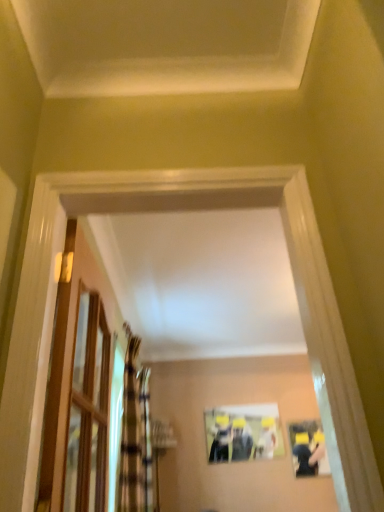
Question: Is the depth of gold textured curtain at left, which is the 1th curtain from front to back, greater than that of matte black couple at center?

Choices:
 (A) yes
 (B) no

Answer: (B)

Question: Is gold textured curtain at left, which is the 1th curtain from front to back, closer to the viewer compared to matte black couple at center?

Choices:
 (A) no
 (B) yes

Answer: (B)

Question: Does gold textured curtain at left, which is the 1th curtain from front to back, have a greater width compared to matte black couple at center?

Choices:
 (A) no
 (B) yes

Answer: (B)

Question: Is gold textured curtain at left, which is the 1th curtain from front to back, at the right side of matte black couple at center?

Choices:
 (A) yes
 (B) no

Answer: (B)

Question: Is gold textured curtain at left, arranged as the second curtain when viewed from the back, bigger than matte black couple at center?

Choices:
 (A) yes
 (B) no

Answer: (A)

Question: Is gold textured curtain at left, which is the 1th curtain from front to back, to the left of matte black couple at center from the viewer's perspective?

Choices:
 (A) no
 (B) yes

Answer: (B)

Question: From a real-world perspective, is matte plastic picture frame at center under clear glass door at left?

Choices:
 (A) yes
 (B) no

Answer: (B)

Question: From the image's perspective, is matte plastic picture frame at center on clear glass door at left?

Choices:
 (A) no
 (B) yes

Answer: (A)

Question: Does matte plastic picture frame at center have a smaller size compared to clear glass door at left?

Choices:
 (A) yes
 (B) no

Answer: (A)

Question: Considering the relative positions of matte plastic picture frame at center and clear glass door at left in the image provided, is matte plastic picture frame at center to the left of clear glass door at left from the viewer's perspective?

Choices:
 (A) no
 (B) yes

Answer: (A)

Question: Is matte plastic picture frame at center further to camera compared to clear glass door at left?

Choices:
 (A) no
 (B) yes

Answer: (B)

Question: Would you say matte plastic picture frame at center is a long distance from clear glass door at left?

Choices:
 (A) yes
 (B) no

Answer: (A)

Question: From a real-world perspective, is plaid fabric curtain at left, which is the 2th curtain from front to back, on top of gold textured curtain at left, which is the 1th curtain from front to back?

Choices:
 (A) yes
 (B) no

Answer: (B)